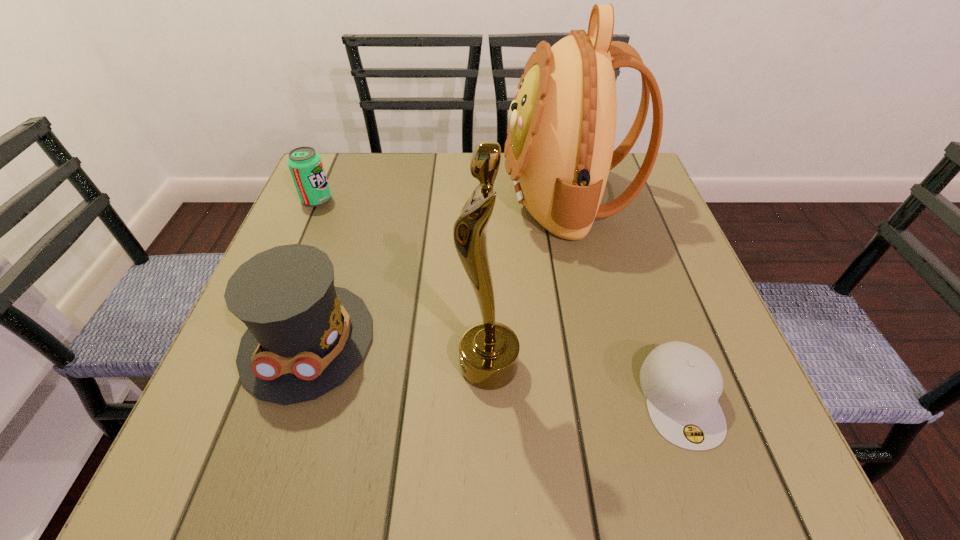
The image size is (960, 540). Find the location of `object located in the far left corner section of the desktop`. object located in the far left corner section of the desktop is located at coordinates (305, 165).

Where is `object located at the far right corner`? object located at the far right corner is located at coordinates (561, 132).

Identify the location of object located in the near right corner section of the desktop. This screenshot has height=540, width=960. (x=682, y=384).

I want to click on free spot at the far edge of the desktop, so click(523, 204).

The height and width of the screenshot is (540, 960). What are the coordinates of `vacant space at the near edge` in the screenshot? It's located at [x=493, y=456].

The image size is (960, 540). In order to click on vacant position at the left edge of the desktop in this screenshot , I will do `click(323, 232)`.

Find the location of a particular element. This screenshot has width=960, height=540. free space at the right edge of the desktop is located at coordinates (661, 299).

You are a GUI agent. You are given a task and a screenshot of the screen. Output one action in this format:
    pyautogui.click(x=<x>, y=<y>)
    Task: Click on the vacant area at the far right corner of the desktop
    Image resolution: width=960 pixels, height=540 pixels.
    Given the screenshot: What is the action you would take?
    pyautogui.click(x=619, y=187)

This screenshot has width=960, height=540. Find the location of `vacant point at the near right corner`. vacant point at the near right corner is located at coordinates (756, 476).

The height and width of the screenshot is (540, 960). What are the coordinates of `empty location between the backpack and the award` in the screenshot? It's located at (527, 282).